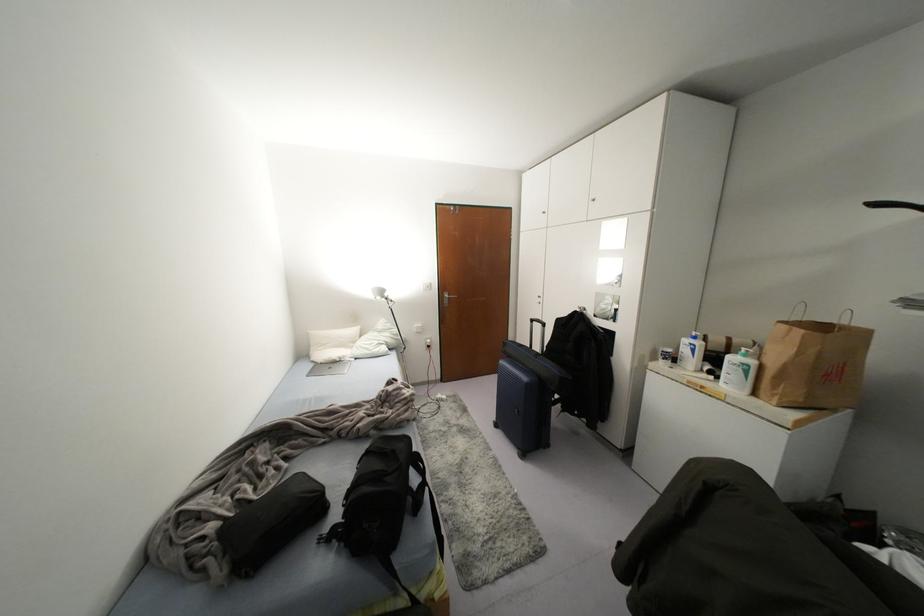
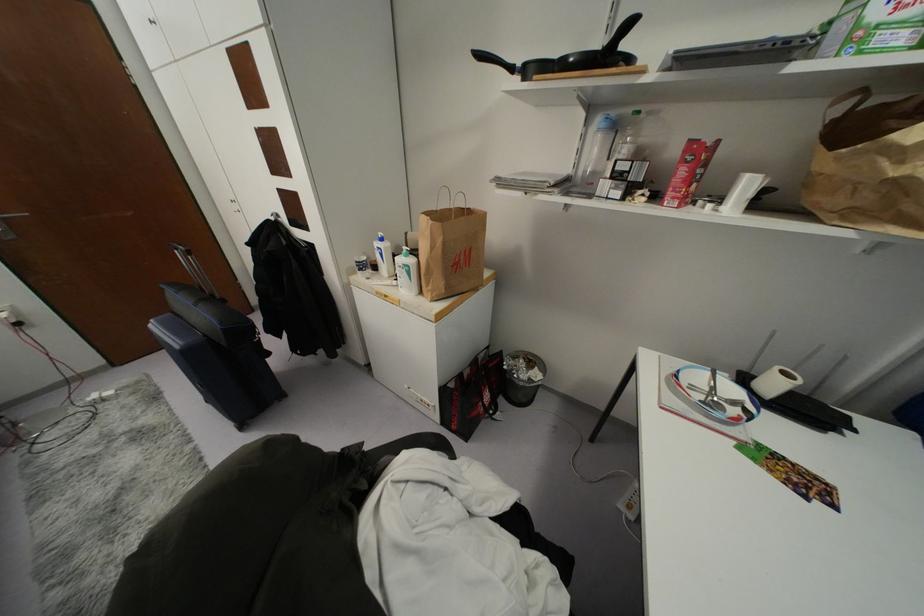
In the scene shown: Based on the continuous images, in which direction is the camera rotating?

The rotation direction of the camera is right-down.